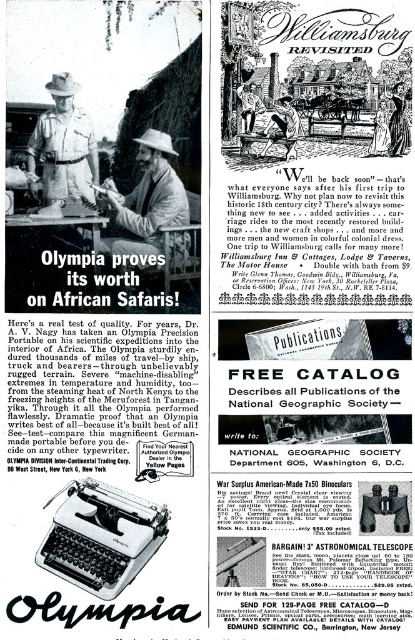
You are standing 1.5 meters away from the advertisement. Is the point at coordinates point [100,241] on the advertisement within your reach?

The point at coordinates point [100,241] is 1.41 meters away from the viewer. Since you are standing 1.5 meters away from the advertisement, the point is slightly closer than your standing position, so it is within reach.

What are the coordinates of the khaki cotton hat at center in the image?

The khaki cotton hat at center is located at coordinates 0.323 in the x axis and 0.359 in the y axis.

In the vintage advertisement, there are two khaki items in the top left section. The khaki cotton hat at center and the khaki uniform at center. Which of these two items appears wider in the image?

The khaki cotton hat at center appears wider than the khaki uniform at center in the image.